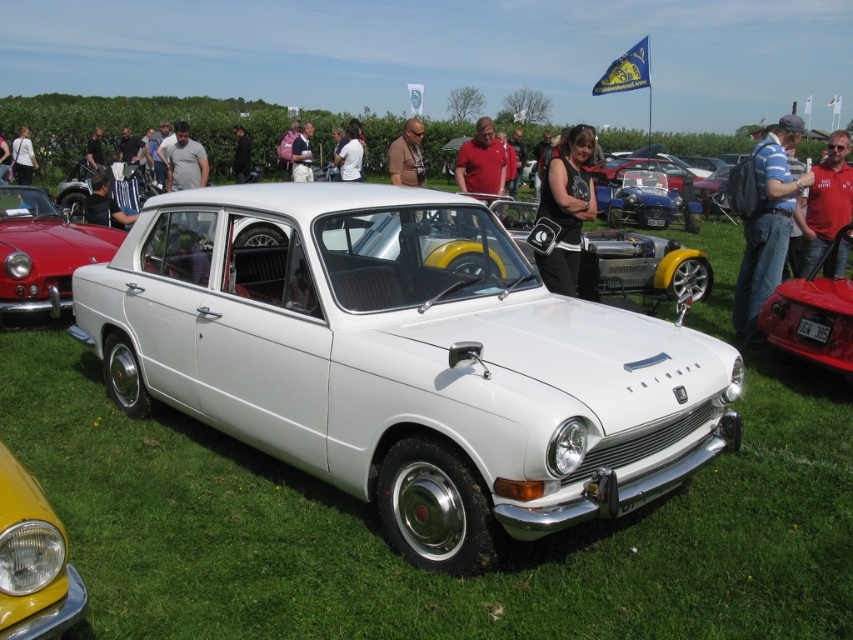
Question: Considering the real-world distances, which object is farthest from the black plastic license plate at center?

Choices:
 (A) red smooth shirt at center
 (B) black leather jacket at center
 (C) white fabric shirt at center
 (D) white cotton shirt at center

Answer: (D)

Question: Does matte black car at center appear under matte black jacket at center?

Choices:
 (A) yes
 (B) no

Answer: (A)

Question: Does red smooth shirt at center appear over white fabric shirt at center?

Choices:
 (A) yes
 (B) no

Answer: (B)

Question: Does white metallic sedan at center appear over shiny red car at right?

Choices:
 (A) no
 (B) yes

Answer: (A)

Question: Which of the following is the farthest from the observer?

Choices:
 (A) shiny red car at right
 (B) matte black car at center
 (C) dark brown leather jacket at center
 (D) red smooth shirt at center

Answer: (C)

Question: Which of the following is the closest to the observer?

Choices:
 (A) (811, 216)
 (B) (296, 152)

Answer: (A)